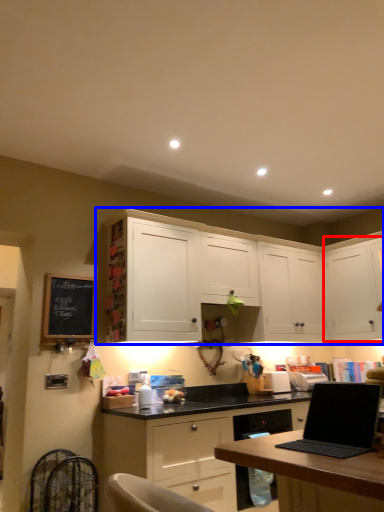
Question: Which point is further to the camera, cabinetry (highlighted by a red box) or cabinetry (highlighted by a blue box)?

Choices:
 (A) cabinetry
 (B) cabinetry

Answer: (A)